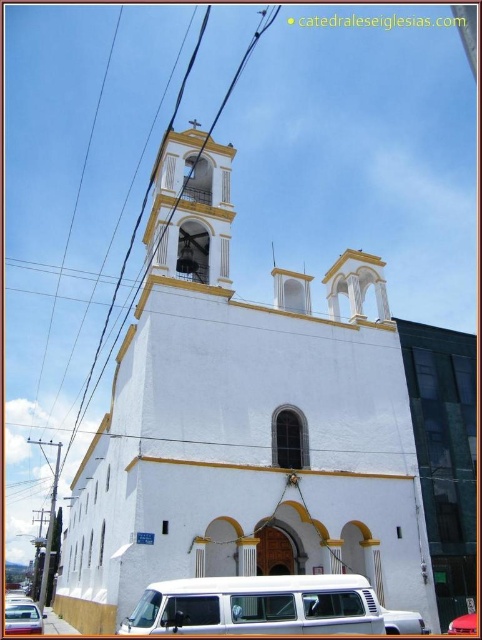
Question: Can you confirm if white matte van at center is smaller than metallic silver van at center?

Choices:
 (A) no
 (B) yes

Answer: (A)

Question: Which object is closer to the camera taking this photo?

Choices:
 (A) white smooth bell tower at upper center
 (B) metallic silver van at lower left
 (C) white matte van at center
 (D) metallic silver van at center

Answer: (C)

Question: Which object is positioned closest to the metallic silver van at lower left?

Choices:
 (A) white matte van at center
 (B) white smooth bell tower at upper center

Answer: (B)

Question: In this image, where is white smooth bell tower at upper center located relative to metallic silver van at lower left?

Choices:
 (A) left
 (B) right

Answer: (B)

Question: Can you confirm if white matte van at center is thinner than metallic silver van at center?

Choices:
 (A) yes
 (B) no

Answer: (B)

Question: Considering the real-world distances, which object is farthest from the metallic silver van at lower left?

Choices:
 (A) white smooth bell tower at upper center
 (B) white matte van at center

Answer: (B)